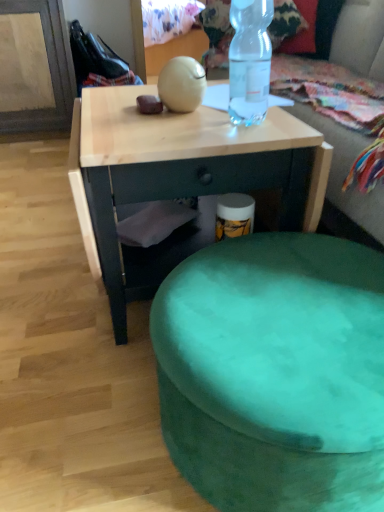
The width and height of the screenshot is (384, 512). I want to click on free point in front of transparent plastic bottle at upper center, so click(x=248, y=135).